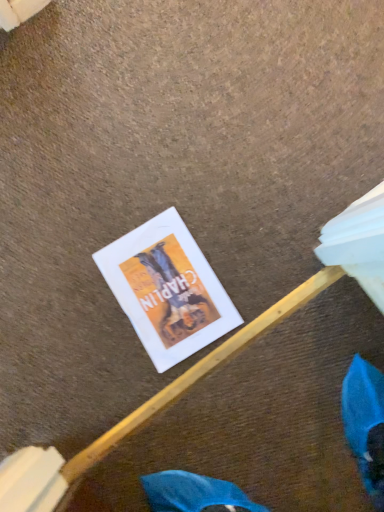
Find the location of a particular element. This screenshot has width=384, height=512. vacant area on top of white paper book at center (from a real-world perspective) is located at coordinates (165, 288).